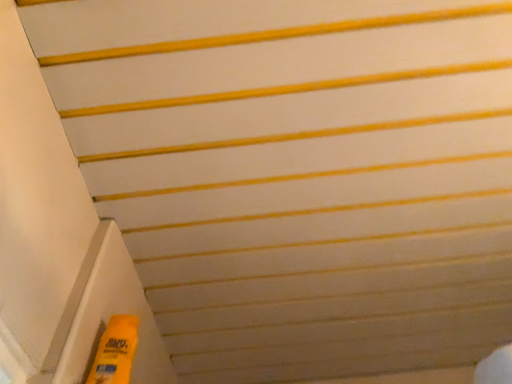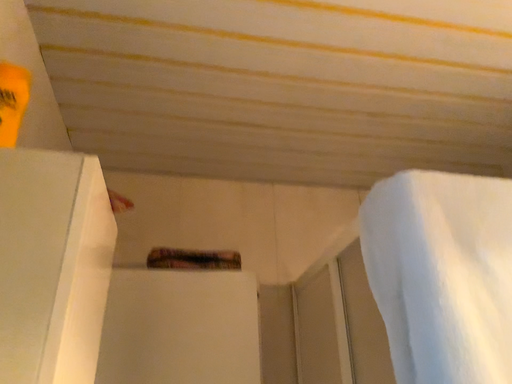
Question: How did the camera likely rotate when shooting the video?

Choices:
 (A) rotated left
 (B) rotated right

Answer: (B)